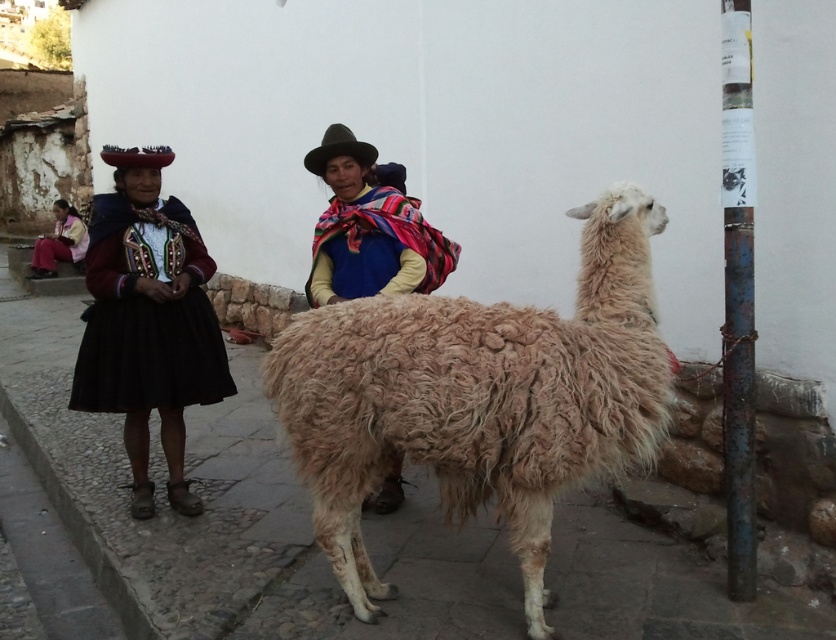
You are a photographer trying to capture the fuzzy beige alpaca at center in your shot. Based on its position, can you determine if it is closer to the front or back of the image?

The fuzzy beige alpaca at center is located at point coordinates indicating it is positioned centrally within the image, neither particularly close to the front nor the back. However, since the llama is described as being in the foreground, and the alpaca is at the center, it is likely closer to the front of the image compared to background elements like the walls.